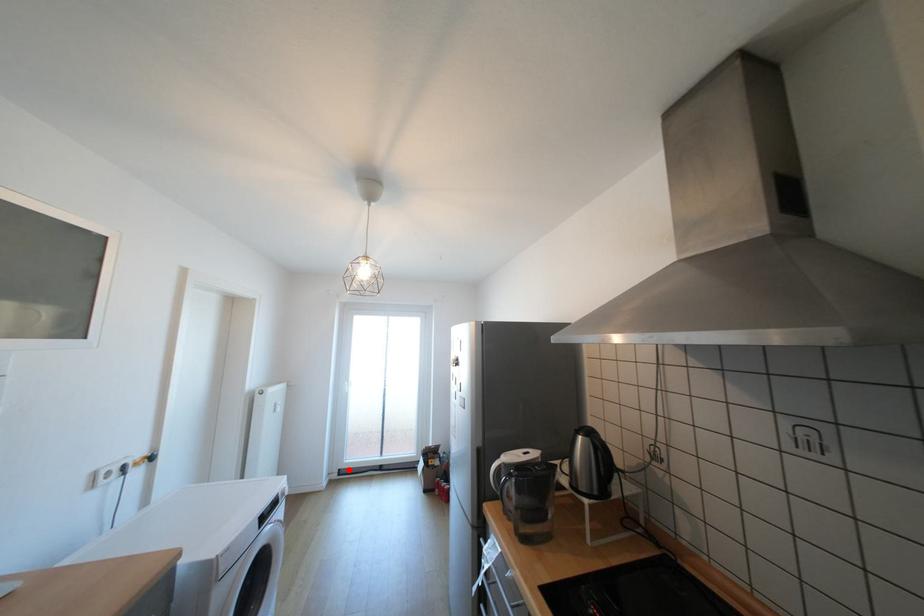
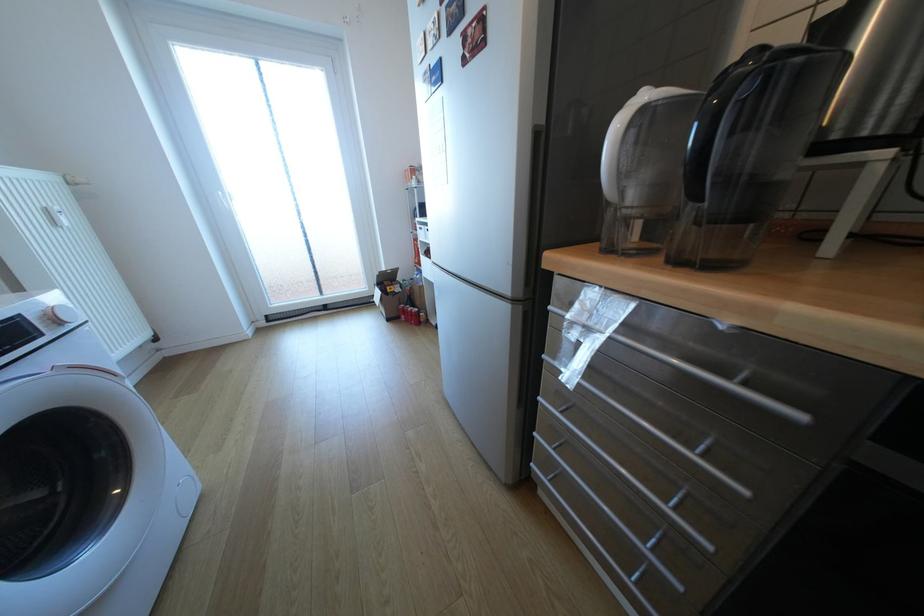
In the second image, find the point that corresponds to the highlighted location in the first image.

(275, 315)